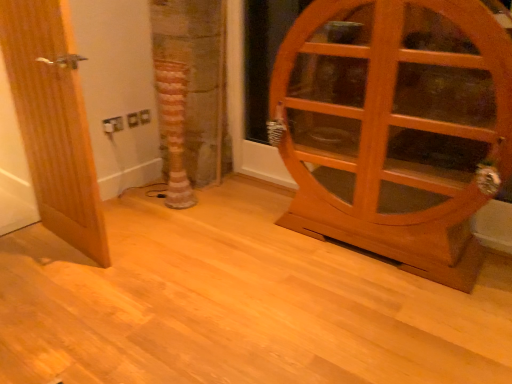
The image size is (512, 384). I want to click on vacant space to the left of wooden cabinet at right, acting as the 1th door starting from the right, so click(x=237, y=248).